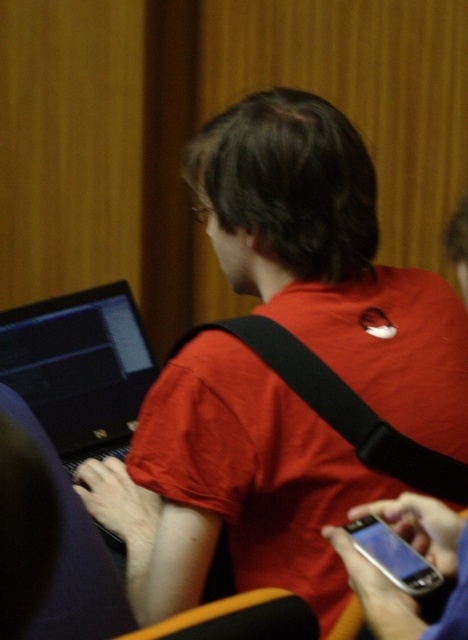
Which is above, black glossy laptop at left or silver metallic smartphone at lower right?

black glossy laptop at left

This screenshot has height=640, width=468. Find the location of `black glossy laptop at left`. black glossy laptop at left is located at coordinates (80, 368).